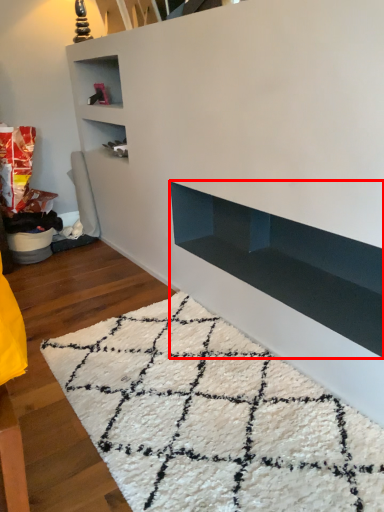
Question: From the image's perspective, what is the correct spatial relationship of shelf (annotated by the red box) in relation to mat?

Choices:
 (A) above
 (B) below

Answer: (A)